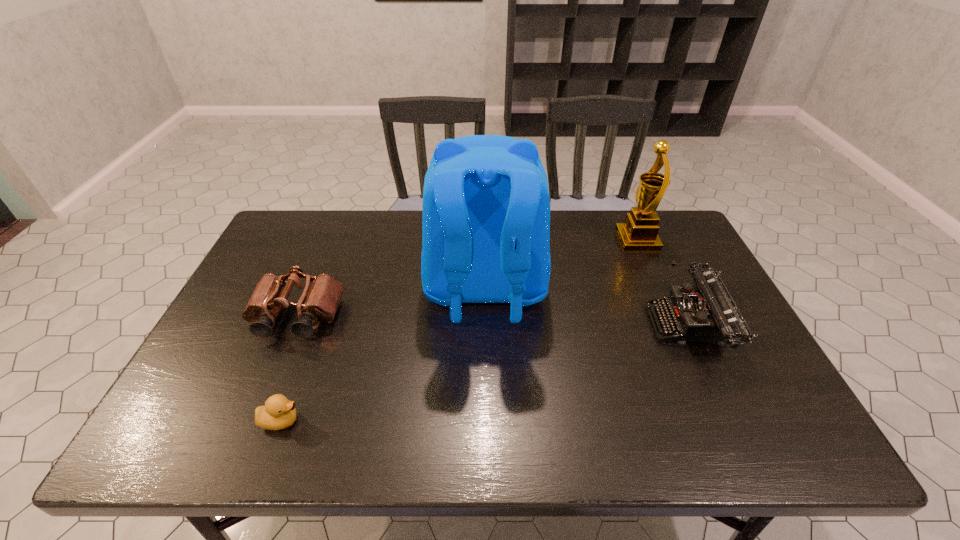
Find the location of a particular element. This screenshot has width=960, height=540. the third object from right to left is located at coordinates (486, 210).

Locate an element on the screen. The width and height of the screenshot is (960, 540). backpack is located at coordinates (486, 210).

You are a GUI agent. You are given a task and a screenshot of the screen. Output one action in this format:
    pyautogui.click(x=<x>, y=<y>)
    Task: Click on the fourth shortest object
    
    Given the screenshot: What is the action you would take?
    pyautogui.click(x=639, y=233)

Where is `typewriter`? The height and width of the screenshot is (540, 960). typewriter is located at coordinates (705, 312).

Where is `binoculars`? This screenshot has width=960, height=540. binoculars is located at coordinates (319, 302).

Image resolution: width=960 pixels, height=540 pixels. Identify the location of duckling. (278, 413).

You are a GUI agent. You are given a task and a screenshot of the screen. Output one action in this format:
    pyautogui.click(x=<x>, y=<y>)
    Task: Click on the nearest object
    The image size is (960, 540).
    Given the screenshot: What is the action you would take?
    pyautogui.click(x=278, y=413)

Locate an element on the screen. The width and height of the screenshot is (960, 540). blank space located on the back of the tallest object is located at coordinates (487, 435).

Image resolution: width=960 pixels, height=540 pixels. Identify the location of free space located 0.300m on the front-facing side of the award. (527, 240).

Find the location of a particular element. Image resolution: width=960 pixels, height=540 pixels. vacant space positioned 0.140m on the front-facing side of the award is located at coordinates (576, 240).